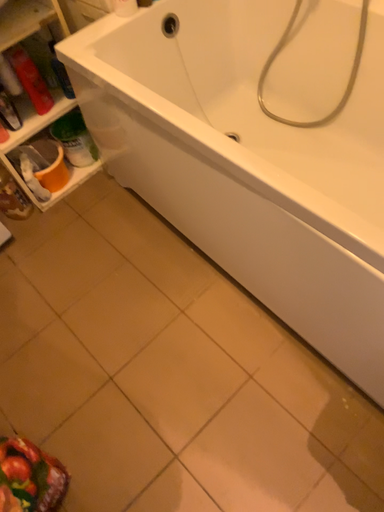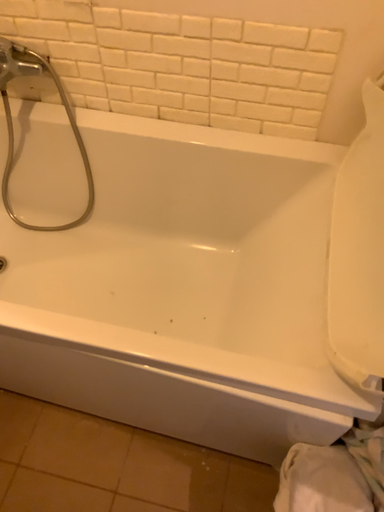
Question: Which way did the camera rotate in the video?

Choices:
 (A) rotated left
 (B) rotated right

Answer: (B)